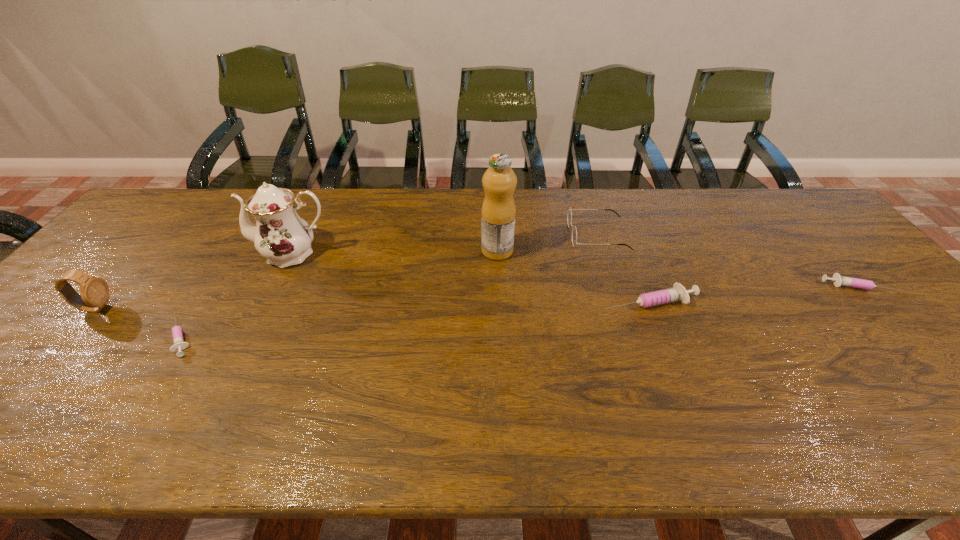
In order to click on vacant space that satisfies the following two spatial constraints: 1. on the front label of the fruit juice; 2. on the left side of the tallest syringe in this screenshot , I will do `click(499, 302)`.

I want to click on vacant position in the image that satisfies the following two spatial constraints: 1. on the back side of the second tallest syringe; 2. on the front label of the fruit juice, so click(x=826, y=251).